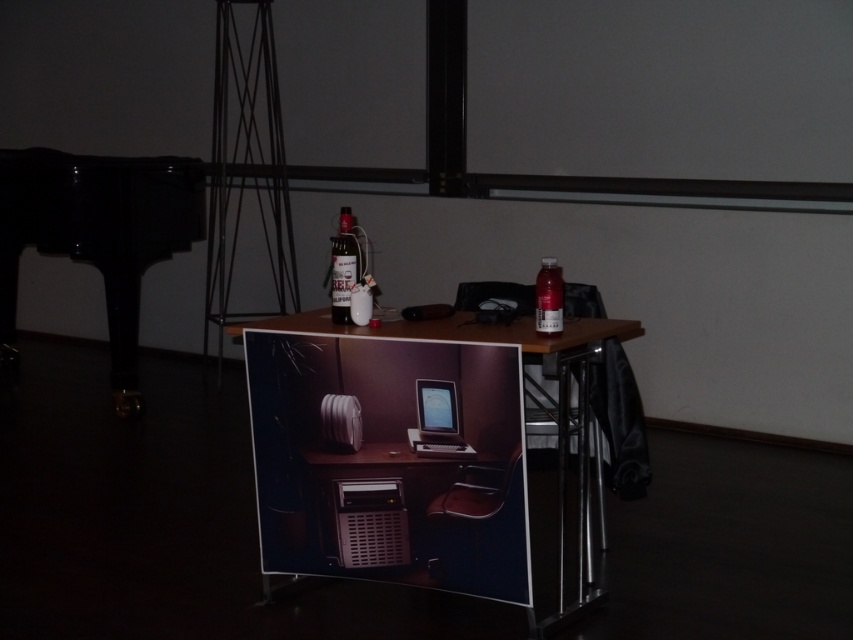
Question: Which of the following is the farthest from the observer?

Choices:
 (A) (540, 310)
 (B) (433, 454)
 (C) (54, 227)
 (D) (363, 516)

Answer: (C)

Question: Which point is closer to the camera?

Choices:
 (A) (457, 420)
 (B) (438, 499)
 (C) (598, 305)
 (D) (550, 275)

Answer: (D)

Question: Estimate the real-world distances between objects in this image. Which object is farther from the brown leather chair at center?

Choices:
 (A) matte plastic bottle at center-right
 (B) black polished piano at left

Answer: (B)

Question: Is matte black tablet at center further to the viewer compared to matte plastic bottle at center-right?

Choices:
 (A) no
 (B) yes

Answer: (B)

Question: Does black polished piano at left lie behind matte black tablet at center?

Choices:
 (A) yes
 (B) no

Answer: (A)

Question: Considering the relative positions of matte black monitor at center and matte plastic bottle at center-right in the image provided, where is matte black monitor at center located with respect to matte plastic bottle at center-right?

Choices:
 (A) below
 (B) above

Answer: (A)